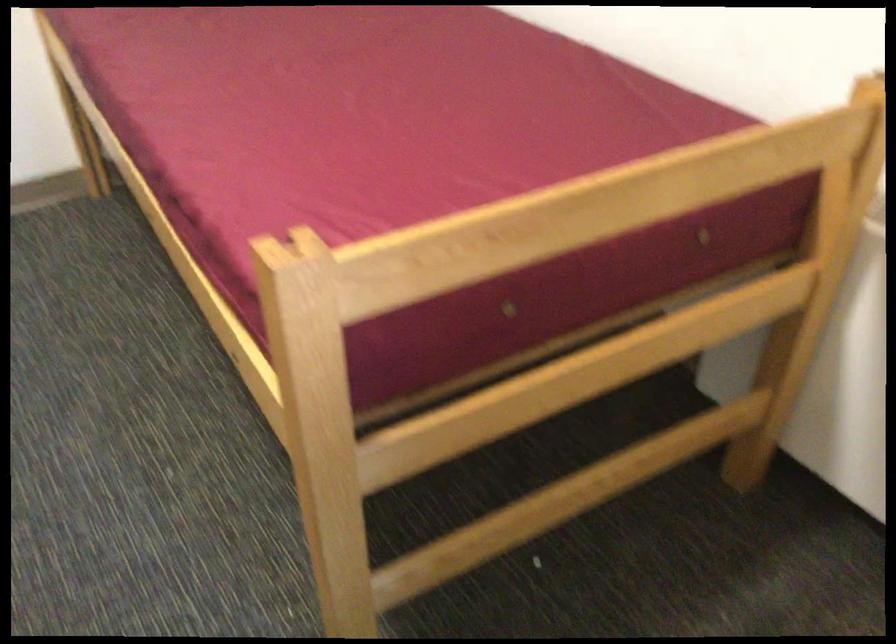
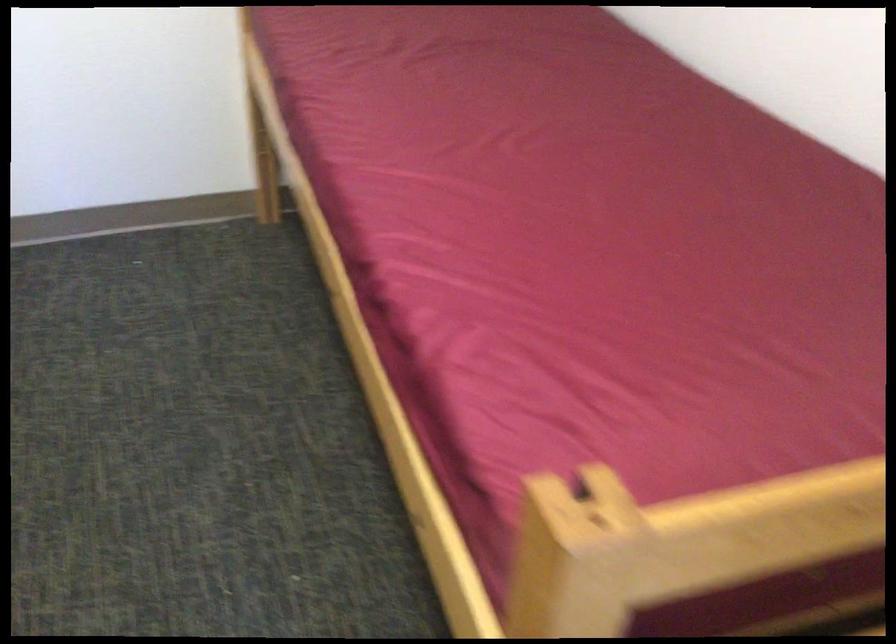
Which direction would the cameraman need to move to produce the second image?

The movement direction of the cameraman is left, forward.